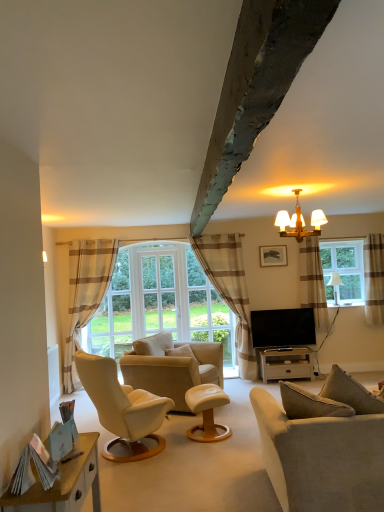
In order to click on brown striped curtain at center, which ranks as the 3th curtain in right-to-left order in this screenshot , I will do `click(229, 289)`.

At what (x,y) coordinates should I click in order to perform the action: click on brown striped curtain at right, which appears as the fourth curtain when viewed from the left. Please return your answer as a coordinate pair (x, y). The width and height of the screenshot is (384, 512). Looking at the image, I should click on (374, 278).

Identify the location of beige striped curtain at left, placed as the fourth curtain when sorted from right to left. The width and height of the screenshot is (384, 512). (85, 294).

The image size is (384, 512). Describe the element at coordinates (335, 284) in the screenshot. I see `white fabric lampshade at right, placed as the 2th lamp when sorted from front to back` at that location.

Image resolution: width=384 pixels, height=512 pixels. Identify the location of wooden picture frame at upper center. (273, 255).

The height and width of the screenshot is (512, 384). Describe the element at coordinates (286, 362) in the screenshot. I see `white wood tv stand at lower right` at that location.

The image size is (384, 512). What do you see at coordinates (207, 412) in the screenshot? I see `white leather stool at center` at bounding box center [207, 412].

The image size is (384, 512). In order to click on brown striped curtain at center, which ranks as the 3th curtain in right-to-left order in this screenshot , I will do `click(229, 289)`.

Who is smaller, beige leather armchair at center or wooden picture frame at upper center?

wooden picture frame at upper center.

In the scene shown: Which is more to the right, beige leather armchair at center or wooden picture frame at upper center?

wooden picture frame at upper center.

From their relative heights in the image, would you say beige leather armchair at center is taller or shorter than wooden picture frame at upper center?

Clearly, beige leather armchair at center is taller compared to wooden picture frame at upper center.

Which object is closer to the camera, beige leather armchair at center or wooden picture frame at upper center?

Positioned in front is beige leather armchair at center.

From a real-world perspective, who is located higher, white fabric lampshade at right, the 1th lamp from the bottom, or beige striped curtain at left, arranged as the 1th curtain when viewed from the left?

From a 3D spatial view, white fabric lampshade at right, the 1th lamp from the bottom, is above.

Considering the positions of point (333, 274) and point (93, 256), is point (333, 274) closer or farther from the camera than point (93, 256)?

Point (333, 274) is positioned farther from the camera compared to point (93, 256).

From the image's perspective, which object appears higher, white fabric lampshade at right, the 1th lamp from the bottom, or beige striped curtain at left, arranged as the 1th curtain when viewed from the left?

white fabric lampshade at right, the 1th lamp from the bottom.

Does white fabric lampshade at right, marked as the first lamp in a back-to-front arrangement, touch beige striped curtain at left, placed as the fourth curtain when sorted from right to left?

There is a gap between white fabric lampshade at right, marked as the first lamp in a back-to-front arrangement, and beige striped curtain at left, placed as the fourth curtain when sorted from right to left.

Does white leather stool at center come behind brown striped curtain at right, positioned as the 3th curtain in left-to-right order?

That is False.

Can you confirm if white leather stool at center is positioned to the right of brown striped curtain at right, the 2th curtain viewed from the right?

In fact, white leather stool at center is to the left of brown striped curtain at right, the 2th curtain viewed from the right.

Does white leather stool at center touch brown striped curtain at right, the 2th curtain viewed from the right?

There is a gap between white leather stool at center and brown striped curtain at right, the 2th curtain viewed from the right.

From a real-world perspective, is white leather stool at center below brown striped curtain at right, the 2th curtain viewed from the right?

Yes, from a real-world perspective, white leather stool at center is under brown striped curtain at right, the 2th curtain viewed from the right.

Considering the sizes of objects white wood tv stand at lower right and wooden desk at lower left in the image provided, who is smaller, white wood tv stand at lower right or wooden desk at lower left?

wooden desk at lower left is smaller.

From the image's perspective, would you say white wood tv stand at lower right is shown under wooden desk at lower left?

Indeed, from the image's perspective, white wood tv stand at lower right is shown beneath wooden desk at lower left.

Considering their positions, is white wood tv stand at lower right located in front of or behind wooden desk at lower left?

white wood tv stand at lower right is positioned farther from the viewer than wooden desk at lower left.

How many degrees apart are the facing directions of white wood tv stand at lower right and wooden desk at lower left?

The facing directions of white wood tv stand at lower right and wooden desk at lower left are 91.2 degrees apart.

From the picture: Can white wood tv stand at lower right be found inside wooden picture frame at upper center?

No.

Is wooden picture frame at upper center aimed at white wood tv stand at lower right?

No, wooden picture frame at upper center does not turn towards white wood tv stand at lower right.

From the image's perspective, relative to white wood tv stand at lower right, is wooden picture frame at upper center above or below?

wooden picture frame at upper center is above white wood tv stand at lower right.

Based on the photo, which is less distant, (283, 261) or (261, 353)?

Point (283, 261) is positioned farther from the camera compared to point (261, 353).

Is flat screen tv at center directly adjacent to white fabric lampshade at right, placed as the 2th lamp when sorted from front to back?

No, flat screen tv at center is not touching white fabric lampshade at right, placed as the 2th lamp when sorted from front to back.

Does flat screen tv at center have a larger size compared to white fabric lampshade at right, placed as the 2th lamp when sorted from front to back?

Yes, flat screen tv at center is bigger than white fabric lampshade at right, placed as the 2th lamp when sorted from front to back.

From a real-world perspective, is flat screen tv at center positioned above or below white fabric lampshade at right, placed as the 2th lamp when sorted from front to back?

From a real-world perspective, flat screen tv at center is physically below white fabric lampshade at right, placed as the 2th lamp when sorted from front to back.

Do you think white wood tv stand at lower right is within light gray fabric couch at lower right, or outside of it?

white wood tv stand at lower right is outside light gray fabric couch at lower right.

Which of these two, white wood tv stand at lower right or light gray fabric couch at lower right, is bigger?

Bigger between the two is light gray fabric couch at lower right.

How different are the orientations of white wood tv stand at lower right and light gray fabric couch at lower right in degrees?

132 degrees.

Identify the location of picture frame on the right of the beige leather armchair at center. 273,255.

Locate an element on the screen. the 1st curtain positioned below the white fabric lampshade at right, acting as the 2th lamp starting from the left (from a real-world perspective) is located at coordinates click(85, 294).

Which object lies further to the anchor point light gray fabric couch at lower right, brown striped curtain at center, which ranks as the 3th curtain in right-to-left order, or white leather stool at center?

Based on the image, brown striped curtain at center, which ranks as the 3th curtain in right-to-left order, appears to be further to light gray fabric couch at lower right.

When comparing their distances from wooden picture frame at upper center, does wooden desk at lower left or beige striped curtain at left, arranged as the 1th curtain when viewed from the left, seem further?

Among the two, wooden desk at lower left is located further to wooden picture frame at upper center.

Estimate the real-world distances between objects in this image. Which object is further from beige leather armchair at center, white fabric lampshade at right, the 1th lamp from the bottom, or wooden desk at lower left?

white fabric lampshade at right, the 1th lamp from the bottom, is further to beige leather armchair at center.

When comparing their distances from white glass window screen at center, does white wood tv stand at lower right or brown striped curtain at right, the 2th curtain viewed from the right, seem further?

Among the two, brown striped curtain at right, the 2th curtain viewed from the right, is located further to white glass window screen at center.

Based on their spatial positions, is clear glass window at right or white leather stool at center closer to flat screen tv at center?

clear glass window at right lies closer to flat screen tv at center than the other object.

Based on their spatial positions, is beige leather armchair at center or light gray fabric couch at lower right closer to flat screen tv at center?

Based on the image, beige leather armchair at center appears to be nearer to flat screen tv at center.

When comparing their distances from white glass window screen at center, does wooden chandelier at upper center, marked as the second lamp in a back-to-front arrangement, or brown striped curtain at right, positioned as the 3th curtain in left-to-right order, seem further?

wooden chandelier at upper center, marked as the second lamp in a back-to-front arrangement.

Looking at the image, which one is located further to wooden desk at lower left, clear glass window at right or flat screen tv at center?

clear glass window at right is further to wooden desk at lower left.

Locate an element on the screen. Image resolution: width=384 pixels, height=512 pixels. table located between light gray fabric couch at lower right and beige striped curtain at left, arranged as the 1th curtain when viewed from the left, in the depth direction is located at coordinates (286, 362).

Where is `window screen between wooden desk at lower left and clear glass window at right from front to back`? The image size is (384, 512). window screen between wooden desk at lower left and clear glass window at right from front to back is located at coordinates (160, 292).

Find the location of `table between wooden desk at lower left and beige striped curtain at left, placed as the fourth curtain when sorted from right to left, along the z-axis`. table between wooden desk at lower left and beige striped curtain at left, placed as the fourth curtain when sorted from right to left, along the z-axis is located at coordinates (286, 362).

The height and width of the screenshot is (512, 384). What are the coordinates of `table between light gray fabric couch at lower right and brown striped curtain at center, positioned as the 2th curtain in left-to-right order, in the front-back direction` in the screenshot? It's located at (286, 362).